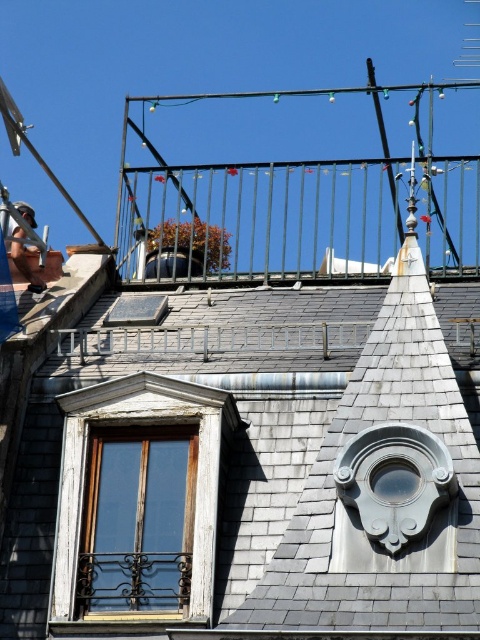
Question: Which of the following is the farthest from the observer?

Choices:
 (A) metallic black balcony at upper center
 (B) wooden window at lower left

Answer: (A)

Question: Does metallic black balcony at upper center appear on the right side of wooden window at lower left?

Choices:
 (A) yes
 (B) no

Answer: (A)

Question: Which object is farther from the camera taking this photo?

Choices:
 (A) metallic black balcony at upper center
 (B) wooden window at center

Answer: (A)

Question: Does wooden window at center lie behind metallic black balcony at upper center?

Choices:
 (A) yes
 (B) no

Answer: (B)

Question: Does wooden window at center appear on the left side of metallic black balcony at upper center?

Choices:
 (A) yes
 (B) no

Answer: (A)

Question: Based on their relative distances, which object is nearer to the wooden window at lower left?

Choices:
 (A) metallic black balcony at upper center
 (B) wooden window at center

Answer: (B)